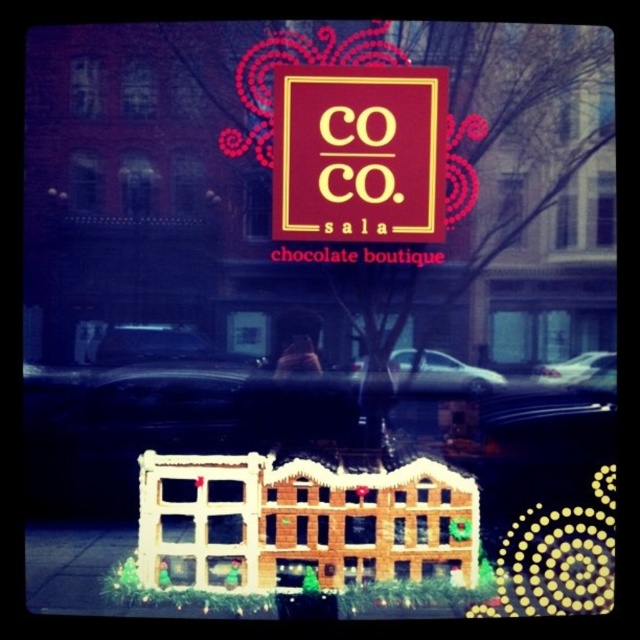
Question: Is maroon matte sign at center to the right of glossy black car at center from the viewer's perspective?

Choices:
 (A) yes
 (B) no

Answer: (B)

Question: Among these objects, which one is farthest from the camera?

Choices:
 (A) black glossy car at center
 (B) metallic silver car at center

Answer: (B)

Question: Which object is positioned closest to the black glossy car at center?

Choices:
 (A) maroon matte sign at center
 (B) matte gold "co" at center
 (C) glossy black car at center
 (D) metallic silver car at center

Answer: (D)

Question: Does black glossy car at center appear under matte gold "co" at center?

Choices:
 (A) yes
 (B) no

Answer: (A)

Question: Estimate the real-world distances between objects in this image. Which object is farther from the black glossy car at center?

Choices:
 (A) glossy black car at center
 (B) maroon matte sign at center
 (C) matte gold "co" at center
 (D) metallic silver car at center

Answer: (A)

Question: Is matte gold "co" at center wider than glossy black car at center?

Choices:
 (A) no
 (B) yes

Answer: (B)